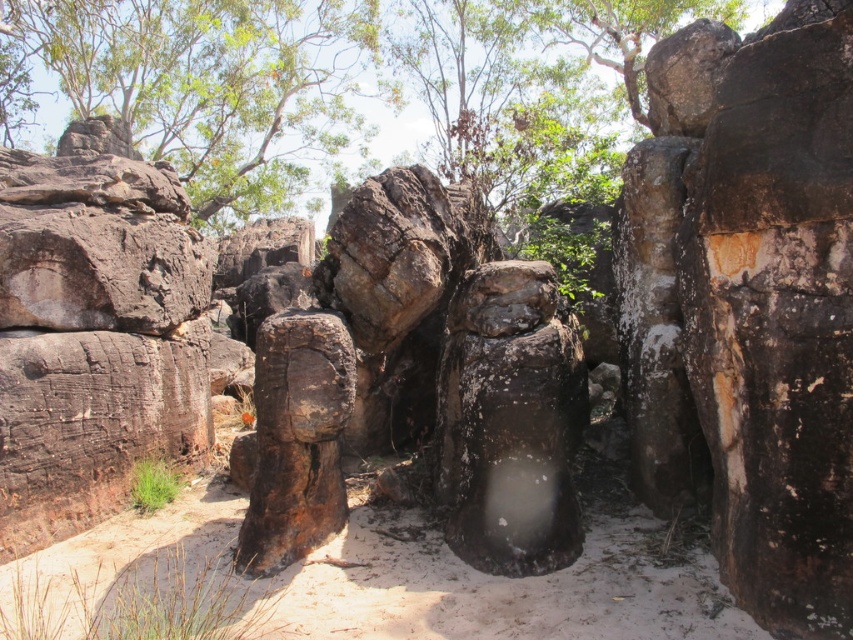
Question: Which point is closer to the camera?

Choices:
 (A) (183, 80)
 (B) (343, 625)

Answer: (B)

Question: From the image, what is the correct spatial relationship of white sandy ground at center in relation to green leafy tree at upper left?

Choices:
 (A) above
 (B) below

Answer: (B)

Question: Among these objects, which one is farthest from the camera?

Choices:
 (A) white sandy ground at center
 (B) green leafy tree at upper left

Answer: (B)

Question: Which object is farther from the camera taking this photo?

Choices:
 (A) green leafy tree at upper left
 (B) white sandy ground at center

Answer: (A)

Question: Is white sandy ground at center behind green leafy tree at upper left?

Choices:
 (A) no
 (B) yes

Answer: (A)

Question: Can you confirm if white sandy ground at center is positioned to the right of green leafy tree at upper left?

Choices:
 (A) yes
 (B) no

Answer: (A)